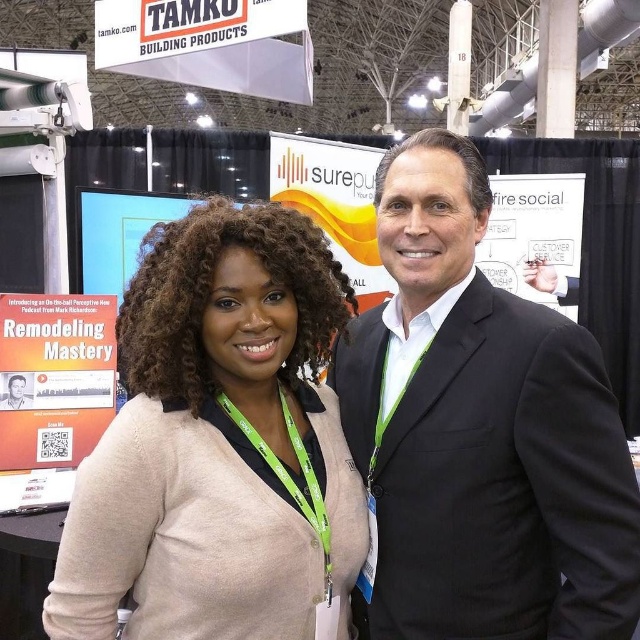
Question: Is black suit at center to the left of beige cardigan at center from the viewer's perspective?

Choices:
 (A) yes
 (B) no

Answer: (B)

Question: Which point appears farthest from the camera in this image?

Choices:
 (A) (218, 506)
 (B) (477, 589)

Answer: (B)

Question: Which object appears farthest from the camera in this image?

Choices:
 (A) beige cardigan at center
 (B) black suit at center

Answer: (A)

Question: Which object appears farthest from the camera in this image?

Choices:
 (A) beige cardigan at center
 (B) black suit at center

Answer: (A)

Question: Can you confirm if black suit at center is thinner than beige cardigan at center?

Choices:
 (A) yes
 (B) no

Answer: (A)

Question: Is black suit at center bigger than beige cardigan at center?

Choices:
 (A) yes
 (B) no

Answer: (A)